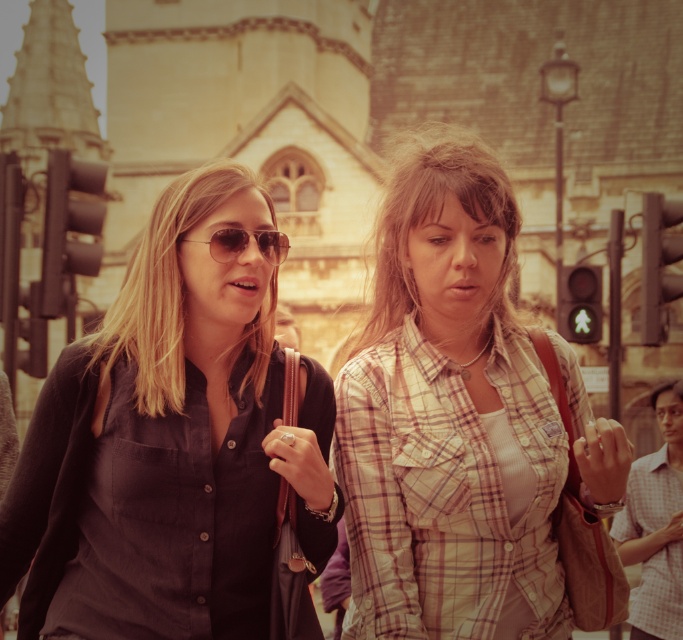
Can you confirm if plaid cotton shirt at center is thinner than matte aviator sunglasses at center?

No, plaid cotton shirt at center is not thinner than matte aviator sunglasses at center.

Is plaid cotton shirt at center smaller than matte aviator sunglasses at center?

No, plaid cotton shirt at center is not smaller than matte aviator sunglasses at center.

Does point (449, 248) lie in front of point (245, 230)?

That is False.

At what (x,y) coordinates should I click in order to perform the action: click on plaid cotton shirt at center. Please return your answer as a coordinate pair (x, y). Looking at the image, I should click on (447, 417).

Who is lower down, plaid cotton shirt at center or plaid shirt at center?

plaid cotton shirt at center

Who is more forward, (550,531) or (451,154)?

Point (550,531)

Locate an element on the screen. This screenshot has width=683, height=640. plaid cotton shirt at center is located at coordinates (447, 417).

Is matte black sunglasses at center thinner than matte aviator sunglasses at center?

In fact, matte black sunglasses at center might be wider than matte aviator sunglasses at center.

Locate an element on the screen. This screenshot has height=640, width=683. matte black sunglasses at center is located at coordinates (163, 289).